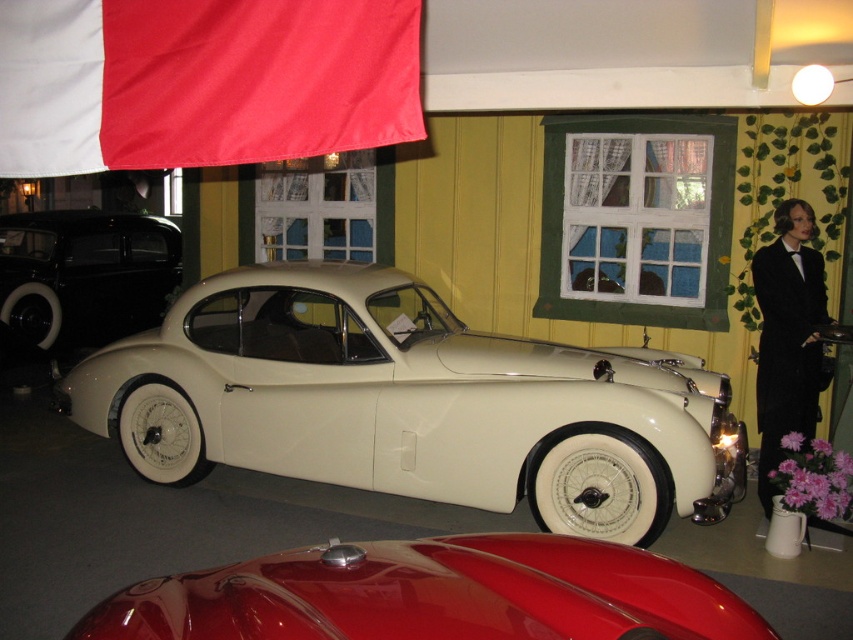
Question: Which of the following is the farthest from the observer?

Choices:
 (A) shiny black car at left
 (B) black velvet coat at right

Answer: (A)

Question: Which point is farther to the camera?

Choices:
 (A) black velvet coat at right
 (B) glossy red car at center

Answer: (A)

Question: Is glossy red car at center positioned in front of black velvet coat at right?

Choices:
 (A) no
 (B) yes

Answer: (B)

Question: Considering the relative positions of cream matte car at center and shiny black car at left in the image provided, where is cream matte car at center located with respect to shiny black car at left?

Choices:
 (A) left
 (B) right

Answer: (B)

Question: Is glossy red car at center positioned before shiny black car at left?

Choices:
 (A) yes
 (B) no

Answer: (A)

Question: Estimate the real-world distances between objects in this image. Which object is closer to the shiny black car at left?

Choices:
 (A) glossy red car at center
 (B) black velvet coat at right
 (C) cream matte car at center

Answer: (C)